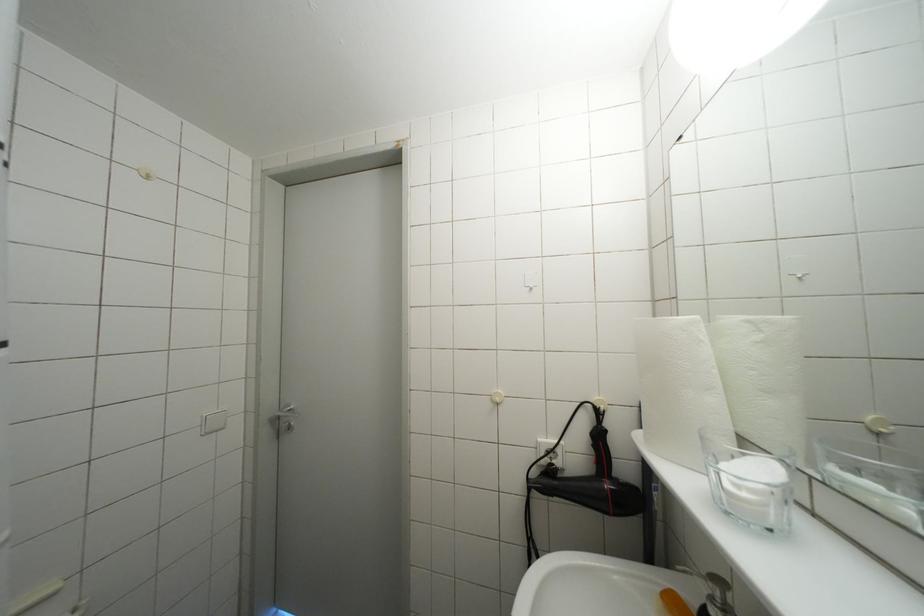
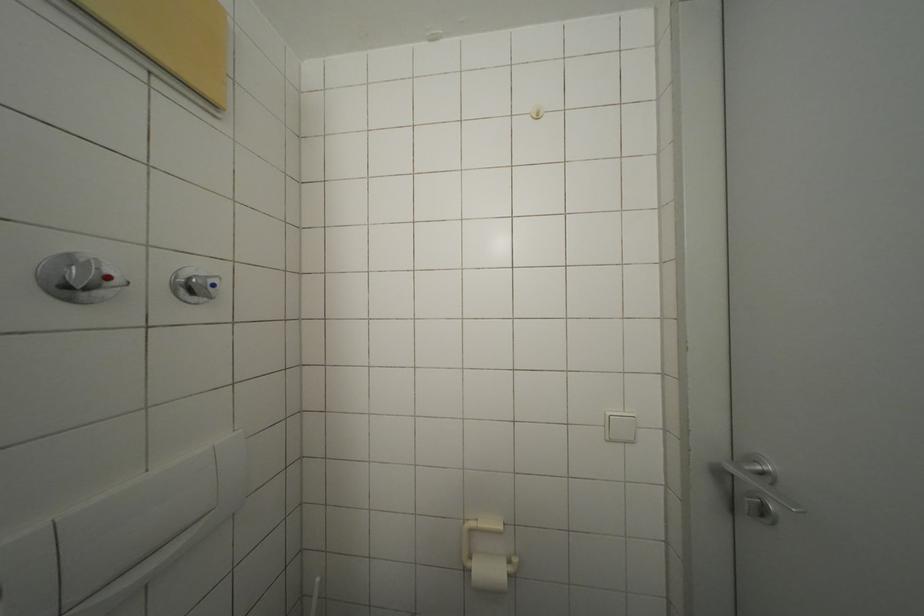
Question: Based on the continuous images, in which direction is the camera rotating? Reply with the corresponding letter.

Choices:
 (A) Left
 (B) Right
 (C) Up
 (D) Down

Answer: (A)